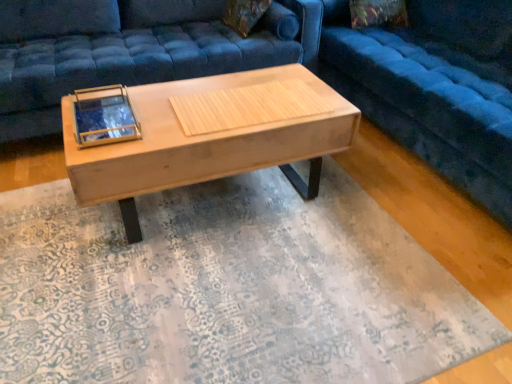
Question: Is natural wood coffee table at center shorter than velvet blue studio couch at center, which is the 2th studio couch in left-to-right order?

Choices:
 (A) yes
 (B) no

Answer: (A)

Question: Is natural wood coffee table at center aimed at velvet blue studio couch at center, acting as the 1th studio couch starting from the right?

Choices:
 (A) no
 (B) yes

Answer: (A)

Question: Is natural wood coffee table at center positioned far away from velvet blue studio couch at center, which is the 2th studio couch in left-to-right order?

Choices:
 (A) yes
 (B) no

Answer: (B)

Question: Is natural wood coffee table at center bigger than velvet blue studio couch at center, which is the 2th studio couch in left-to-right order?

Choices:
 (A) yes
 (B) no

Answer: (B)

Question: Is natural wood coffee table at center closer to the viewer compared to velvet blue studio couch at center, which is the 2th studio couch in left-to-right order?

Choices:
 (A) no
 (B) yes

Answer: (A)

Question: Is natural wood coffee table at center beside velvet blue studio couch at center, acting as the 1th studio couch starting from the right?

Choices:
 (A) no
 (B) yes

Answer: (A)

Question: From a real-world perspective, is velvet blue studio couch at center, arranged as the first studio couch when viewed from the left, under natural wood coffee table at center?

Choices:
 (A) no
 (B) yes

Answer: (A)

Question: Is velvet blue studio couch at center, arranged as the first studio couch when viewed from the left, turned away from natural wood coffee table at center?

Choices:
 (A) yes
 (B) no

Answer: (B)

Question: Considering the relative sizes of velvet blue studio couch at center, arranged as the first studio couch when viewed from the left, and natural wood coffee table at center in the image provided, is velvet blue studio couch at center, arranged as the first studio couch when viewed from the left, thinner than natural wood coffee table at center?

Choices:
 (A) no
 (B) yes

Answer: (A)

Question: Is velvet blue studio couch at center, the second studio couch viewed from the right, beside natural wood coffee table at center?

Choices:
 (A) no
 (B) yes

Answer: (A)

Question: From a real-world perspective, is velvet blue studio couch at center, the second studio couch viewed from the right, located higher than natural wood coffee table at center?

Choices:
 (A) no
 (B) yes

Answer: (B)

Question: Is velvet blue studio couch at center, the second studio couch viewed from the right, wider than natural wood coffee table at center?

Choices:
 (A) yes
 (B) no

Answer: (A)

Question: Is velvet blue studio couch at center, which is the 2th studio couch in left-to-right order, positioned far away from natural wood coffee table at center?

Choices:
 (A) yes
 (B) no

Answer: (B)